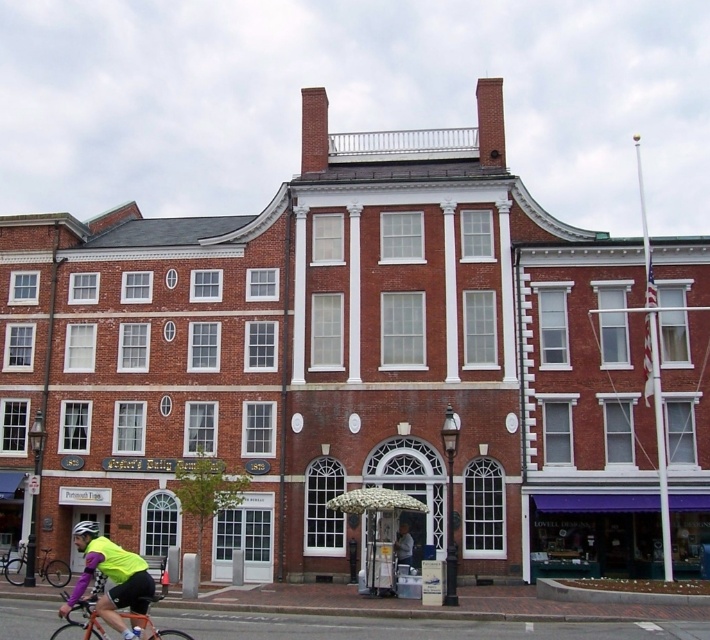
You are a delivery person who needs to park your orange matte bicycle at lower left and white matte bicycle helmet at center near the historic brick building. Given that the parking space is only 1.2 meters wide, will both items fit side by side without overlapping?

The orange matte bicycle at lower left is wider than the white matte bicycle helmet at center. However, since the total width of both items combined is not provided, it is impossible to determine if they will fit in the 1.2 meter parking space.

From the picture: You are a delivery person who needs to pick up a package from the historic brick building. You see an orange matte bicycle at lower left and a white matte bicycle helmet at center. Which object is closer to the ground?

The orange matte bicycle at lower left is closer to the ground because it is located below the white matte bicycle helmet at center.

You are a delivery person who needs to load a package onto your black matte bicycle at lower left. There is a neon yellow jersey at lower left in the way. Based on the scene, can you lift the jersey to access the bicycle?

The neon yellow jersey at lower left is located above the black matte bicycle at lower left, so you can easily lift the jersey to access the bicycle.